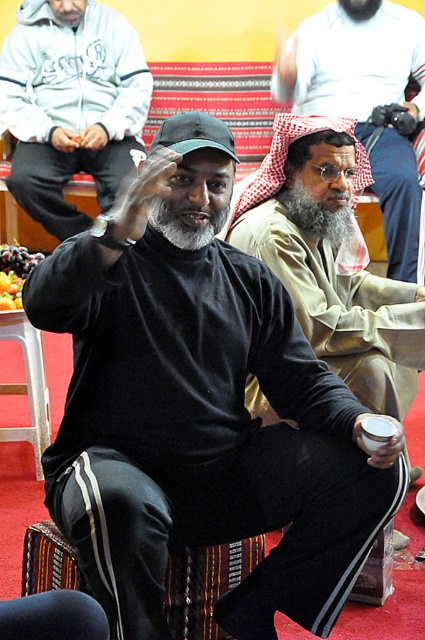
You are a photographer standing 10 feet away from the scene. You want to capture a photo that includes both the matte black sweater at center and the beige textured robe at center. Given that your camera has a maximum focus range of 8 feet, will you be able to capture both subjects clearly in the same frame?

The matte black sweater at center and beige textured robe at center are 5.42 feet apart from each other. Since the camera has a maximum focus range of 8 feet, which is greater than the distance between the two subjects, you can capture both clearly in the same frame.

You are standing in the room and want to locate the black matte turtleneck at center. According to the coordinates provided, where should you look?

The black matte turtleneck at center is located at coordinates point (x=70, y=104).

You are a photographer trying to capture the central figure in the image. The black matte turtleneck at center and beige textured robe at center are both visible in the frame. Which clothing item is covering the other?

The black matte turtleneck at center is positioned over the beige textured robe at center, so it is covering the robe.